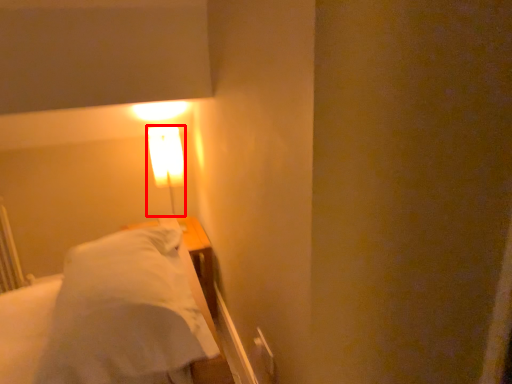
Question: From the image's perspective, considering the relative positions of lamp (annotated by the red box) and bed in the image provided, where is lamp (annotated by the red box) located with respect to the staircase?

Choices:
 (A) below
 (B) above

Answer: (B)